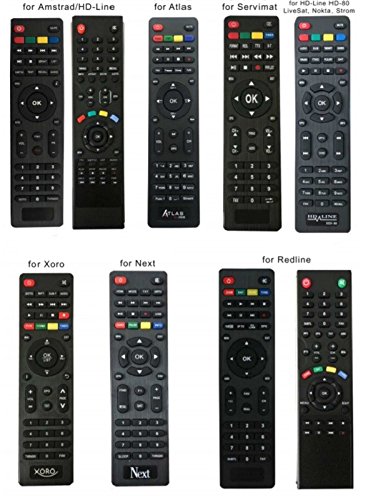
Where is `remote`? remote is located at coordinates (57, 369), (135, 371), (242, 365), (345, 363), (331, 91), (222, 105), (164, 107), (103, 104), (29, 117).